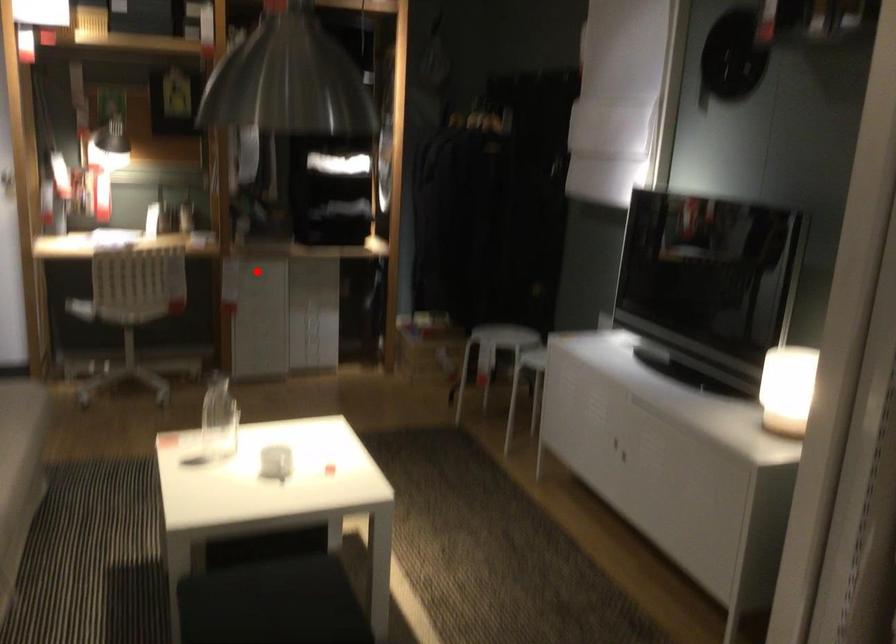
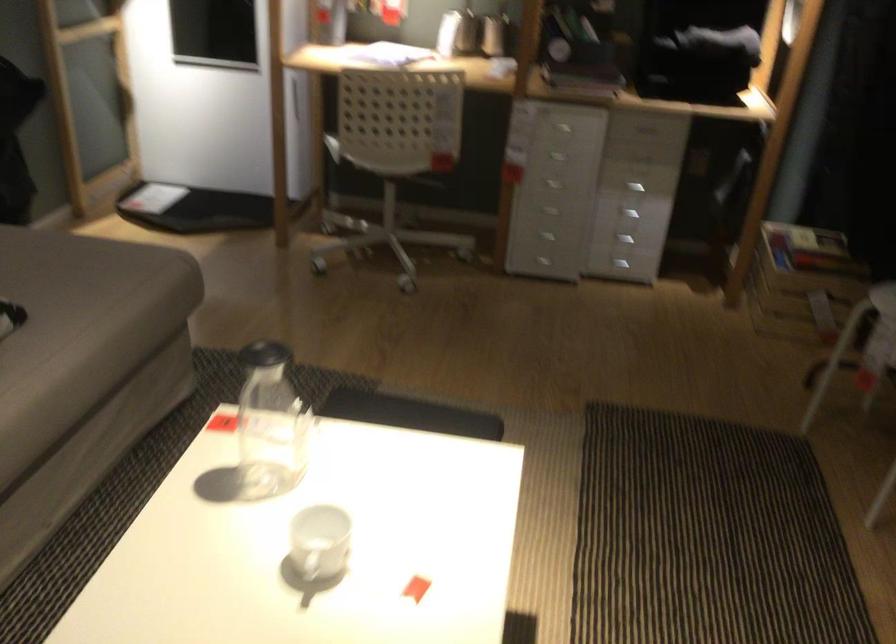
Question: I am providing you with two images of the same scene from different viewpoints. Given a red point in image1, look at the same physical point in image2. Is it:

Choices:
 (A) Closer to the viewpoint
 (B) Farther from the viewpoint

Answer: (A)